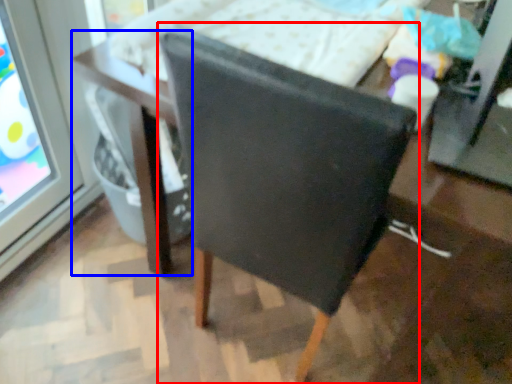
Question: Among these objects, which one is farthest to the camera, chair (highlighted by a red box) or table (highlighted by a blue box)?

Choices:
 (A) chair
 (B) table

Answer: (B)